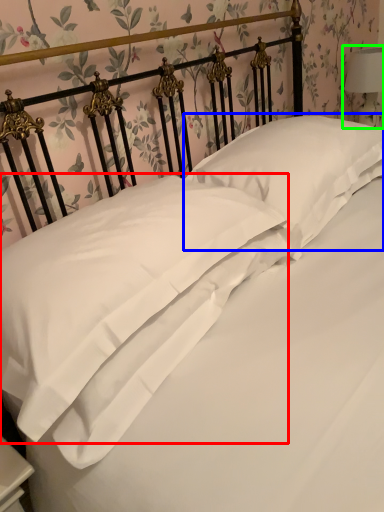
Question: Based on their relative distances, which object is nearer to pillow (highlighted by a red box)? Choose from pillow (highlighted by a blue box) and bedside lamp (highlighted by a green box).

Choices:
 (A) pillow
 (B) bedside lamp

Answer: (A)